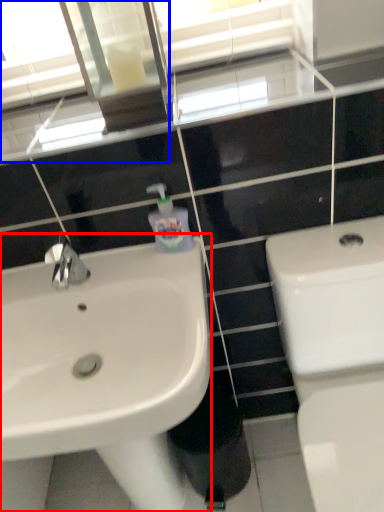
Question: Which object is further to the camera taking this photo, sink (highlighted by a red box) or mirror (highlighted by a blue box)?

Choices:
 (A) sink
 (B) mirror

Answer: (B)